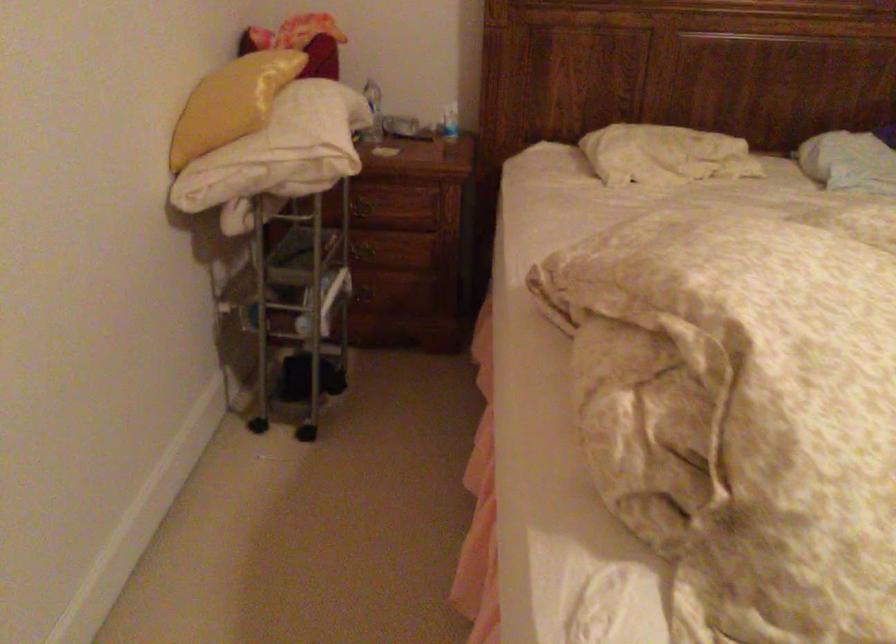
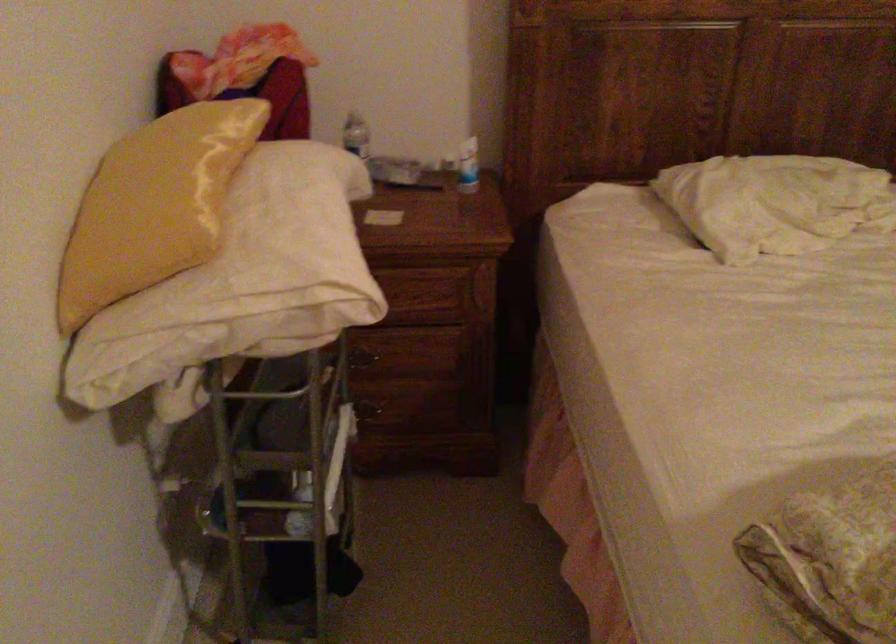
Question: The first image is from the beginning of the video and the second image is from the end. How did the camera likely rotate when shooting the video?

Choices:
 (A) Left
 (B) Right
 (C) Up
 (D) Down

Answer: (B)